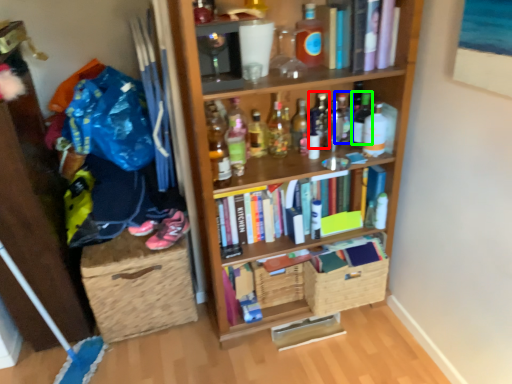
Question: Based on their relative distances, which object is nearer to bottle (highlighted by a red box)? Choose from bottle (highlighted by a blue box) and bottle (highlighted by a green box).

Choices:
 (A) bottle
 (B) bottle

Answer: (A)